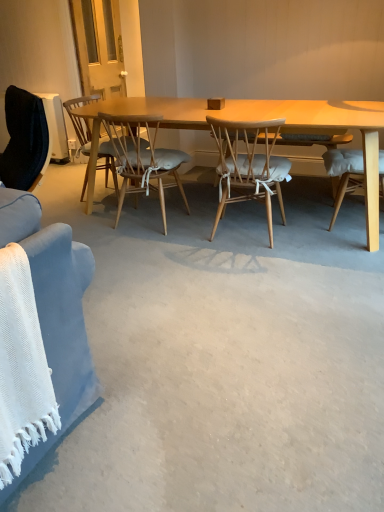
Question: Considering the relative positions of light brown wood chair at center, which ranks as the 2th chair in left-to-right order, and light brown woven wood chair at center, the first chair positioned from the right, in the image provided, is light brown wood chair at center, which ranks as the 2th chair in left-to-right order, to the right of light brown woven wood chair at center, the first chair positioned from the right, from the viewer's perspective?

Choices:
 (A) no
 (B) yes

Answer: (A)

Question: Is light brown wood chair at center, the second chair in the right-to-left sequence, wider than light brown woven wood chair at center, placed as the 3th chair when sorted from left to right?

Choices:
 (A) yes
 (B) no

Answer: (B)

Question: From the image's perspective, is light brown wood chair at center, which ranks as the 2th chair in left-to-right order, over light brown woven wood chair at center, the first chair positioned from the right?

Choices:
 (A) yes
 (B) no

Answer: (A)

Question: Is light brown wood chair at center, the second chair in the right-to-left sequence, next to light brown woven wood chair at center, placed as the 3th chair when sorted from left to right?

Choices:
 (A) no
 (B) yes

Answer: (A)

Question: Is the position of light brown wood chair at center, the second chair in the right-to-left sequence, more distant than that of light brown woven wood chair at center, placed as the 3th chair when sorted from left to right?

Choices:
 (A) no
 (B) yes

Answer: (B)

Question: Considering the relative sizes of light brown wood chair at center, the second chair in the right-to-left sequence, and light brown woven wood chair at center, the first chair positioned from the right, in the image provided, is light brown wood chair at center, the second chair in the right-to-left sequence, shorter than light brown woven wood chair at center, the first chair positioned from the right,?

Choices:
 (A) no
 (B) yes

Answer: (A)

Question: Does wooden chair with cushion at center, acting as the 3th chair starting from the right, appear on the left side of light brown woven wood chair at center, placed as the 3th chair when sorted from left to right?

Choices:
 (A) yes
 (B) no

Answer: (A)

Question: Can we say wooden chair with cushion at center, acting as the 3th chair starting from the right, lies outside light brown woven wood chair at center, the first chair positioned from the right?

Choices:
 (A) yes
 (B) no

Answer: (A)

Question: Is wooden chair with cushion at center, which ranks as the 1th chair in left-to-right order, facing towards light brown woven wood chair at center, the first chair positioned from the right?

Choices:
 (A) yes
 (B) no

Answer: (A)

Question: Is wooden chair with cushion at center, acting as the 3th chair starting from the right, in contact with light brown woven wood chair at center, the first chair positioned from the right?

Choices:
 (A) no
 (B) yes

Answer: (A)

Question: Would you consider wooden chair with cushion at center, acting as the 3th chair starting from the right, to be distant from light brown woven wood chair at center, the first chair positioned from the right?

Choices:
 (A) no
 (B) yes

Answer: (B)

Question: Considering the relative sizes of wooden chair with cushion at center, acting as the 3th chair starting from the right, and light brown woven wood chair at center, the first chair positioned from the right, in the image provided, is wooden chair with cushion at center, acting as the 3th chair starting from the right, smaller than light brown woven wood chair at center, the first chair positioned from the right,?

Choices:
 (A) yes
 (B) no

Answer: (A)

Question: Is light brown wood chair at center, which ranks as the 2th chair in left-to-right order, not close to wooden chair with cushion at center, which ranks as the 1th chair in left-to-right order?

Choices:
 (A) yes
 (B) no

Answer: (B)